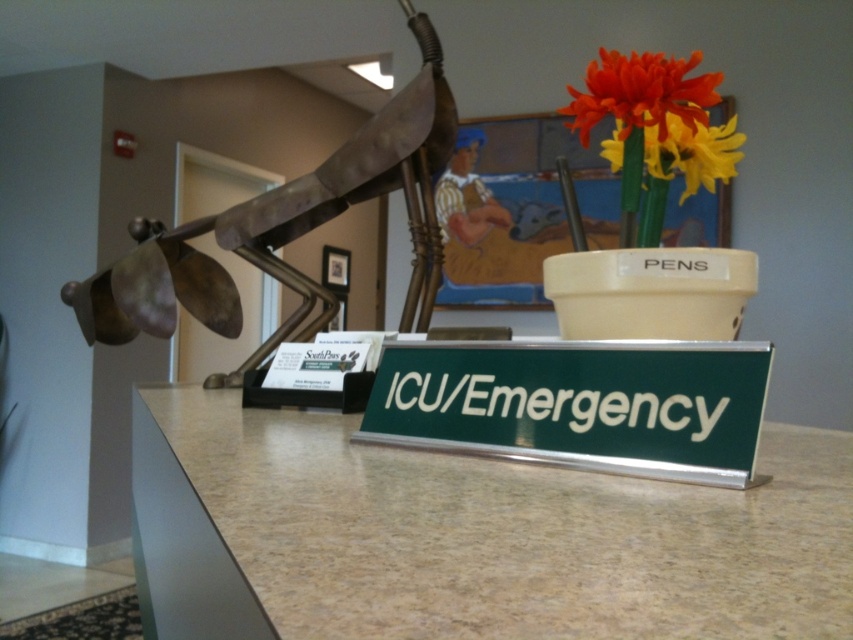
Is metallic sculpture at center above orange matte flower at upper right?

Incorrect, metallic sculpture at center is not positioned above orange matte flower at upper right.

Is metallic sculpture at center wider than orange matte flower at upper right?

Yes.

Where is `metallic sculpture at center`? This screenshot has width=853, height=640. metallic sculpture at center is located at coordinates (281, 228).

Where is `metallic sculpture at center`? This screenshot has width=853, height=640. metallic sculpture at center is located at coordinates pyautogui.click(x=281, y=228).

Is green marble counter top at center thinner than orange matte flower at upper right?

No, green marble counter top at center is not thinner than orange matte flower at upper right.

Is green marble counter top at center positioned at the back of orange matte flower at upper right?

No, it is in front of orange matte flower at upper right.

Is point (792, 544) positioned after point (700, 113)?

No.

Where is `green marble counter top at center`? green marble counter top at center is located at coordinates (468, 536).

Between white matte vase at center and vibrant plastic flowers at upper right, which one is positioned lower?

white matte vase at center is lower down.

Consider the image. Is white matte vase at center wider than vibrant plastic flowers at upper right?

No, white matte vase at center is not wider than vibrant plastic flowers at upper right.

At what (x,y) coordinates should I click in order to perform the action: click on white matte vase at center. Please return your answer as a coordinate pair (x, y). Looking at the image, I should click on tap(650, 292).